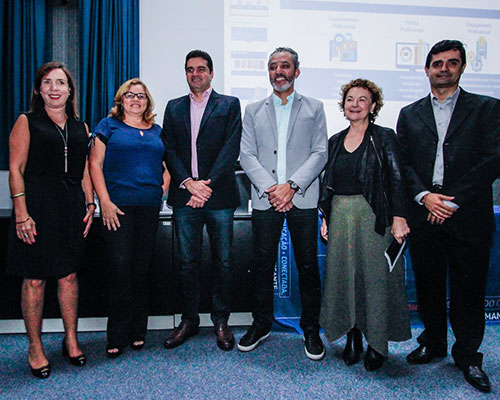
At what (x,y) coordinates should I click in order to perform the action: click on draped logo'd cloth on conference table. Please return your answer as a coordinate pair (x, y). The width and height of the screenshot is (500, 400). Looking at the image, I should click on (285, 276), (404, 275), (493, 276).